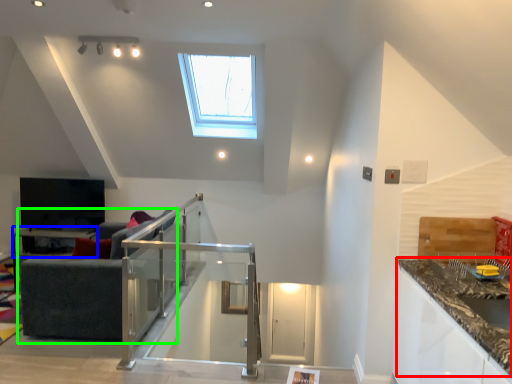
Question: Which object is the closest to the countertop (highlighted by a red box)? Choose among these: table (highlighted by a blue box) or studio couch (highlighted by a green box).

Choices:
 (A) table
 (B) studio couch

Answer: (B)